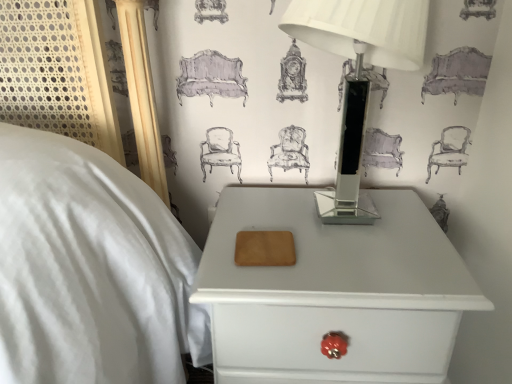
Find the location of a particular element. vacant area in front of clear glass table lamp at upper right is located at coordinates (354, 272).